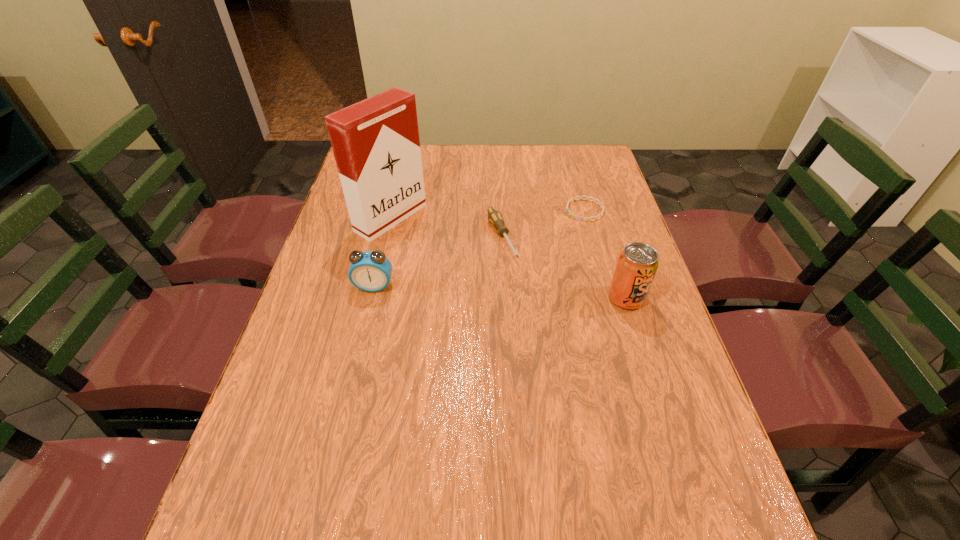
At what (x,y) coordinates should I click in order to perform the action: click on bracelet at the right edge. Please return your answer as a coordinate pair (x, y). Looking at the image, I should click on (580, 197).

This screenshot has width=960, height=540. I want to click on free space at the far edge, so click(x=547, y=144).

Find the location of a particular element. The height and width of the screenshot is (540, 960). free location at the near edge of the desktop is located at coordinates (618, 487).

In the image, there is a desktop. At what (x,y) coordinates should I click in order to perform the action: click on vacant space at the left edge. Please return your answer as a coordinate pair (x, y). The height and width of the screenshot is (540, 960). Looking at the image, I should click on (330, 230).

I want to click on blank space at the right edge of the desktop, so click(589, 248).

In order to click on vacant space at the near right corner of the desktop in this screenshot , I will do `click(698, 464)`.

In order to click on free spot between the fourth shortest object and the tallest object in this screenshot , I will do `click(509, 258)`.

This screenshot has height=540, width=960. Find the location of `blank region between the third object from left to right and the cigarette_case`. blank region between the third object from left to right and the cigarette_case is located at coordinates (446, 228).

The height and width of the screenshot is (540, 960). What are the coordinates of `vacant point located between the shortest object and the third object from left to right` in the screenshot? It's located at [x=543, y=224].

This screenshot has height=540, width=960. In order to click on vacant area that lies between the alarm clock and the soda can in this screenshot , I will do `click(500, 292)`.